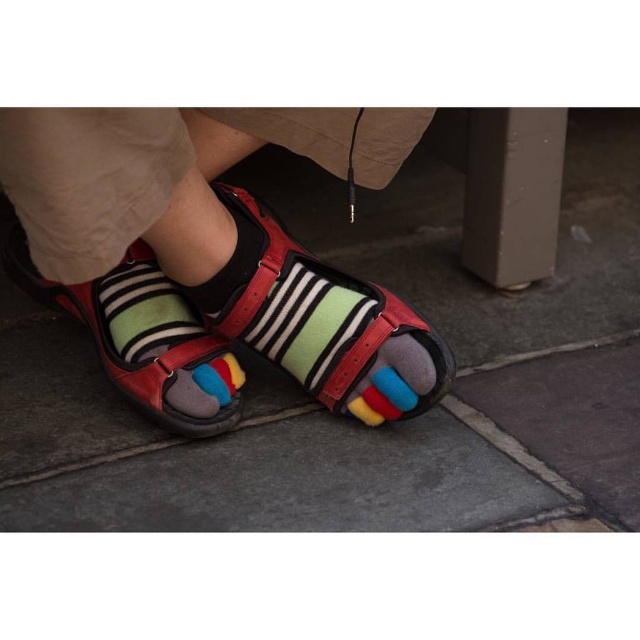
Can you confirm if multicolored wool socks at center is shorter than leather sandals at center?

Incorrect, multicolored wool socks at center's height does not fall short of leather sandals at center's.

Is multicolored wool socks at center wider than leather sandals at center?

Yes, multicolored wool socks at center is wider than leather sandals at center.

Is point (64, 148) closer to viewer compared to point (84, 298)?

Yes, point (64, 148) is in front of point (84, 298).

This screenshot has width=640, height=640. I want to click on multicolored wool socks at center, so click(x=218, y=260).

Who is taller, multicolored wool socks at center or leather sandal at center?

multicolored wool socks at center is taller.

You are a GUI agent. You are given a task and a screenshot of the screen. Output one action in this format:
    pyautogui.click(x=<x>, y=<y>)
    Task: Click on the multicolored wool socks at center
    This screenshot has width=640, height=640.
    Given the screenshot: What is the action you would take?
    pyautogui.click(x=218, y=260)

Is point (204, 212) less distant than point (288, 348)?

Yes, point (204, 212) is closer to viewer.

I want to click on multicolored wool socks at center, so click(218, 260).

Is point (230, 192) closer to viewer compared to point (182, 378)?

No, it is not.

Does leather sandal at center have a greater height compared to leather sandals at center?

Yes.

This screenshot has width=640, height=640. I want to click on leather sandal at center, so click(x=321, y=323).